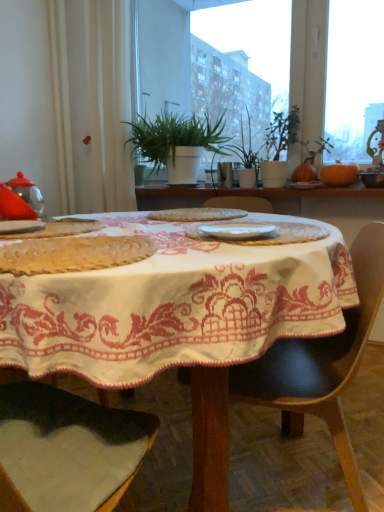
This screenshot has height=512, width=384. Identify the location of vacant space in front of white matte plate at left, the second tableware positioned from the left. (27, 240).